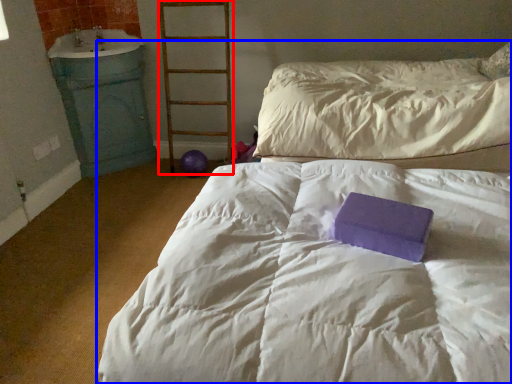
Question: Which object is further to the camera taking this photo, ladder (highlighted by a red box) or bed (highlighted by a blue box)?

Choices:
 (A) ladder
 (B) bed

Answer: (A)